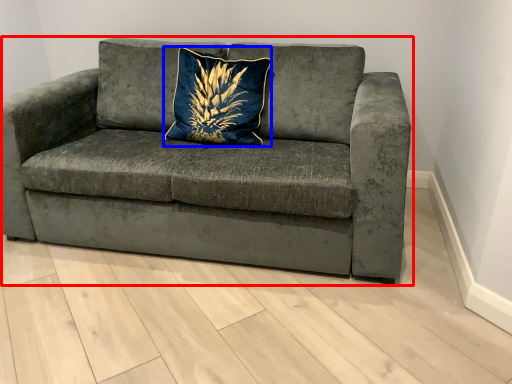
Question: Which object appears closest to the camera in this image, studio couch (highlighted by a red box) or pillow (highlighted by a blue box)?

Choices:
 (A) studio couch
 (B) pillow

Answer: (A)